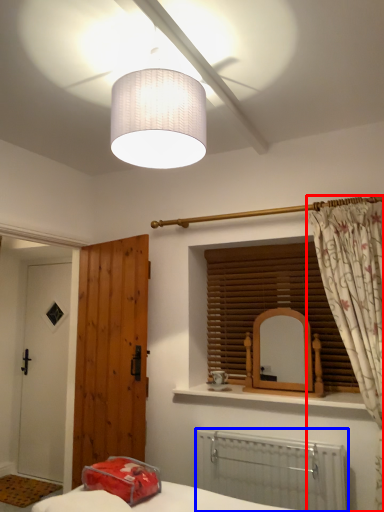
Question: Which of the following is the farthest to the observer, curtain (highlighted by a red box) or radiator (highlighted by a blue box)?

Choices:
 (A) curtain
 (B) radiator

Answer: (B)